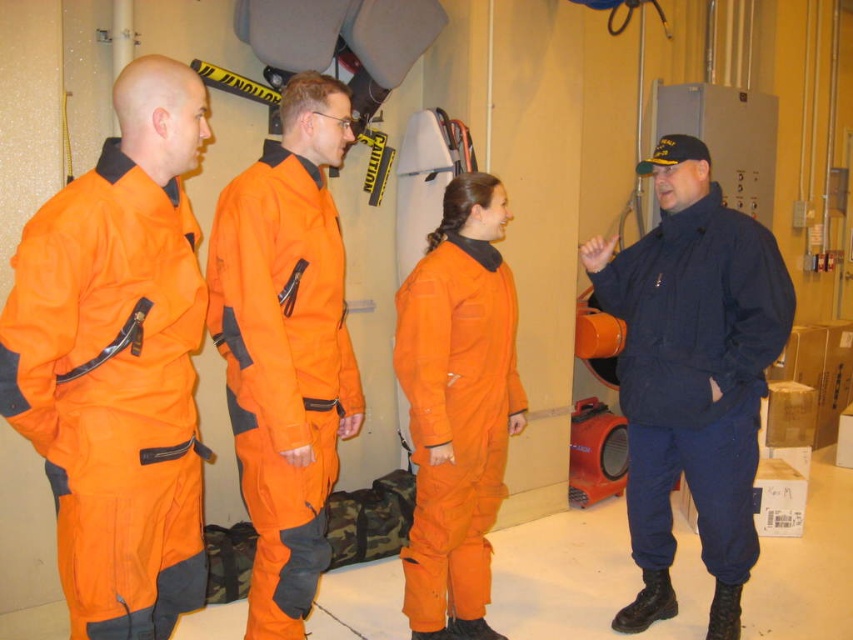
Question: Is navy blue uniform at right to the right of orange matte jumpsuit at center from the viewer's perspective?

Choices:
 (A) yes
 (B) no

Answer: (A)

Question: Estimate the real-world distances between objects in this image. Which object is farther from the orange matte jumpsuit at left?

Choices:
 (A) orange matte jumpsuit at center
 (B) orange fabric jumpsuit at center
 (C) navy blue uniform at right

Answer: (C)

Question: Which object appears closest to the camera in this image?

Choices:
 (A) navy blue uniform at right
 (B) orange matte jumpsuit at left

Answer: (B)

Question: Which point is closer to the camera?

Choices:
 (A) orange matte jumpsuit at center
 (B) orange fabric jumpsuit at center
 (C) navy blue uniform at right

Answer: (B)

Question: Is navy blue uniform at right bigger than orange matte jumpsuit at center?

Choices:
 (A) no
 (B) yes

Answer: (B)

Question: Observing the image, what is the correct spatial positioning of orange matte jumpsuit at left in reference to navy blue uniform at right?

Choices:
 (A) right
 (B) left

Answer: (B)